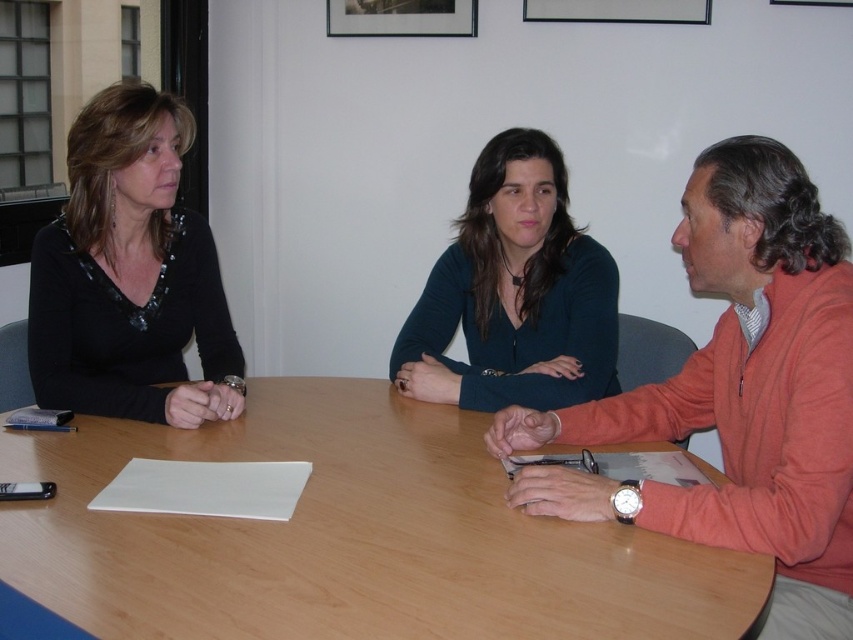
Question: Which point is closer to the camera taking this photo?

Choices:
 (A) (193, 122)
 (B) (599, 492)

Answer: (B)

Question: Does orange fleece jacket at right appear on the left side of teal matte sweater at center?

Choices:
 (A) yes
 (B) no

Answer: (B)

Question: Is orange fleece jacket at right above black matte shirt at left?

Choices:
 (A) yes
 (B) no

Answer: (B)

Question: Among these points, which one is nearest to the camera?

Choices:
 (A) (589, 348)
 (B) (350, 620)
 (C) (94, 304)

Answer: (B)

Question: Where is orange fleece jacket at right located in relation to teal matte sweater at center in the image?

Choices:
 (A) left
 (B) right

Answer: (B)

Question: Which point is farther to the camera?

Choices:
 (A) orange fleece jacket at right
 (B) teal matte sweater at center

Answer: (B)